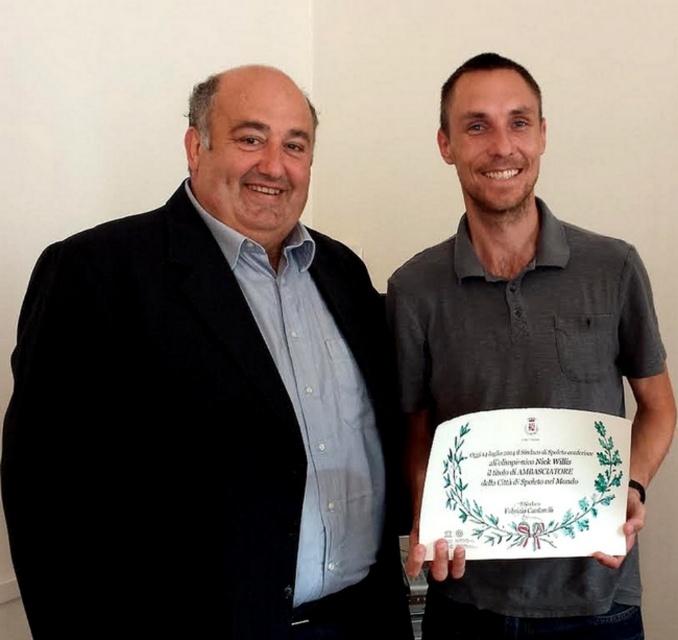
You are a photographer setting up for a group photo. You need to position the matte black suit at left and the gray cotton polo shirt at center so that both are visible in the frame. Based on their current positions, which clothing item is lower in the image?

The matte black suit at left is below the gray cotton polo shirt at center, so the matte black suit at left is lower in the image.